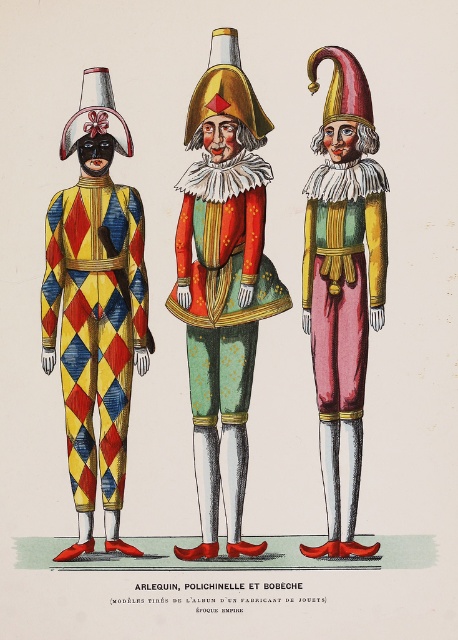
Between harlequin costume at center and harlequin costume at left, which one has less height?

With less height is harlequin costume at center.

Which is more to the left, harlequin costume at center or harlequin costume at left?

From the viewer's perspective, harlequin costume at left appears more on the left side.

Is point (81, 220) farther from viewer compared to point (74, 276)?

Yes, it is behind point (74, 276).

Locate an element on the screen. harlequin costume at center is located at coordinates (223, 284).

Between point (336, 60) and point (104, 344), which one is positioned behind?

The point (336, 60) is more distant.

Which is below, matte gold jester hat at center or harlequin costume at left?

matte gold jester hat at center is below.

Is point (321, 324) farther from camera compared to point (115, 339)?

No, it is not.

You are a GUI agent. You are given a task and a screenshot of the screen. Output one action in this format:
    pyautogui.click(x=<x>, y=<y>)
    Task: Click on the matte gold jester hat at center
    The height and width of the screenshot is (640, 458).
    Given the screenshot: What is the action you would take?
    pyautogui.click(x=343, y=278)

Between harlequin costume at center and matte gold jester hat at center, which one appears on the right side from the viewer's perspective?

harlequin costume at center

Does harlequin costume at center lie behind matte gold jester hat at center?

No.

What do you see at coordinates (223, 284) in the screenshot? I see `harlequin costume at center` at bounding box center [223, 284].

I want to click on harlequin costume at center, so click(x=223, y=284).